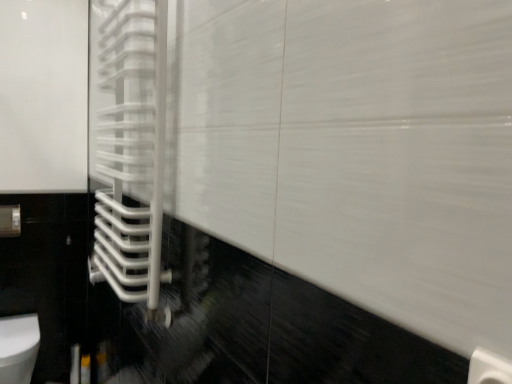
Question: From a real-world perspective, is white glossy toilet at lower left above or below white glossy towel rack at left?

Choices:
 (A) above
 (B) below

Answer: (B)

Question: In the image, is white glossy toilet at lower left positioned in front of or behind white glossy towel rack at left?

Choices:
 (A) behind
 (B) front

Answer: (A)

Question: Is white glossy toilet at lower left bigger or smaller than white glossy towel rack at left?

Choices:
 (A) small
 (B) big

Answer: (A)

Question: Would you say white glossy towel rack at left is inside or outside white glossy toilet at lower left?

Choices:
 (A) inside
 (B) outside

Answer: (B)

Question: Looking at the image, does white glossy towel rack at left seem bigger or smaller compared to white glossy toilet at lower left?

Choices:
 (A) big
 (B) small

Answer: (A)

Question: Looking at their shapes, would you say white glossy towel rack at left is wider or thinner than white glossy toilet at lower left?

Choices:
 (A) wide
 (B) thin

Answer: (B)

Question: From their relative heights in the image, would you say white glossy towel rack at left is taller or shorter than white glossy toilet at lower left?

Choices:
 (A) short
 (B) tall

Answer: (B)